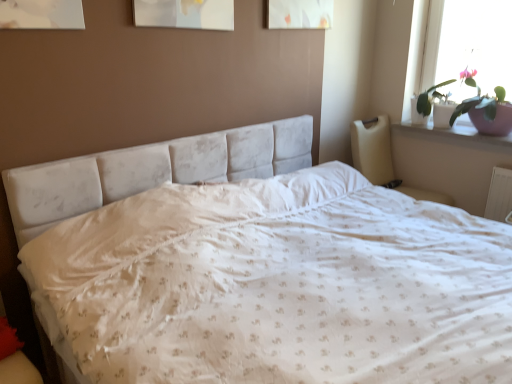
Question: Does beige fabric armchair at right lie in front of white glossy window sill at upper right?

Choices:
 (A) yes
 (B) no

Answer: (A)

Question: Considering the relative sizes of beige fabric armchair at right and white glossy window sill at upper right in the image provided, is beige fabric armchair at right thinner than white glossy window sill at upper right?

Choices:
 (A) no
 (B) yes

Answer: (A)

Question: Considering the relative sizes of beige fabric armchair at right and white glossy window sill at upper right in the image provided, is beige fabric armchair at right shorter than white glossy window sill at upper right?

Choices:
 (A) yes
 (B) no

Answer: (B)

Question: From a real-world perspective, is beige fabric armchair at right physically below white glossy window sill at upper right?

Choices:
 (A) yes
 (B) no

Answer: (A)

Question: Would you say beige fabric armchair at right is a long distance from white glossy window sill at upper right?

Choices:
 (A) yes
 (B) no

Answer: (B)

Question: Is beige fabric armchair at right taller than white glossy window sill at upper right?

Choices:
 (A) no
 (B) yes

Answer: (B)

Question: Does beige fabric armchair at right turn towards pink ceramic pot at upper right?

Choices:
 (A) yes
 (B) no

Answer: (B)

Question: Can you confirm if beige fabric armchair at right is wider than pink ceramic pot at upper right?

Choices:
 (A) yes
 (B) no

Answer: (A)

Question: From the image's perspective, is beige fabric armchair at right on top of pink ceramic pot at upper right?

Choices:
 (A) no
 (B) yes

Answer: (A)

Question: Is beige fabric armchair at right looking in the opposite direction of pink ceramic pot at upper right?

Choices:
 (A) no
 (B) yes

Answer: (A)

Question: Considering the relative sizes of beige fabric armchair at right and pink ceramic pot at upper right in the image provided, is beige fabric armchair at right shorter than pink ceramic pot at upper right?

Choices:
 (A) yes
 (B) no

Answer: (B)

Question: Is beige fabric armchair at right to the left of pink ceramic pot at upper right from the viewer's perspective?

Choices:
 (A) yes
 (B) no

Answer: (A)

Question: Is white glossy window sill at upper right surrounded by white velvety bed at center?

Choices:
 (A) yes
 (B) no

Answer: (B)